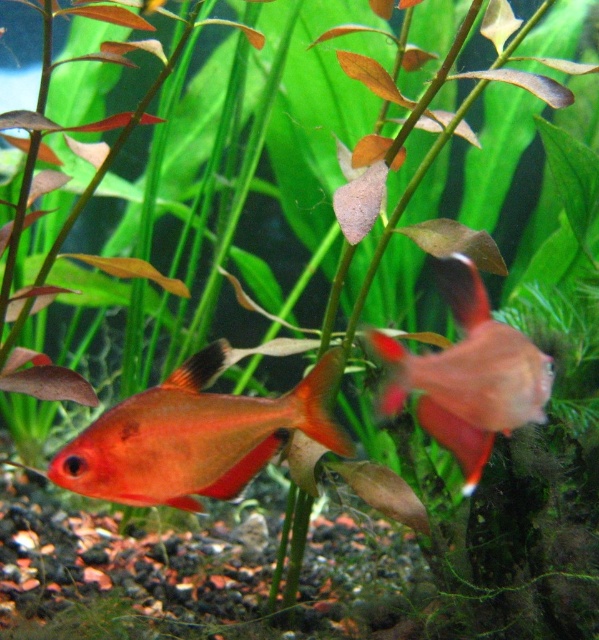
You are an underwater explorer observing the aquarium. You notice the shiny orange fish at center and the glossy red fish at center. Which fish is located below the other?

The shiny orange fish at center is positioned under the glossy red fish at center.